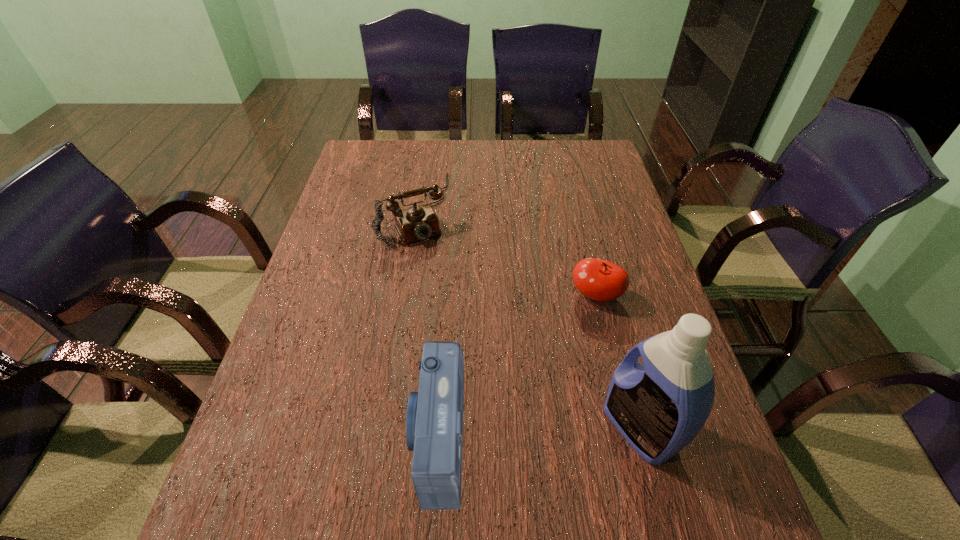
Find the location of a particular element. This screenshot has width=960, height=540. object at the far left corner is located at coordinates (416, 223).

Locate an element on the screen. Image resolution: width=960 pixels, height=540 pixels. object that is at the near right corner is located at coordinates (659, 407).

In order to click on free point at the far edge in this screenshot , I will do (534, 141).

In the image, there is a desktop. What are the coordinates of `vacant space at the near edge` in the screenshot? It's located at (487, 444).

In order to click on vacant region at the left edge of the desktop in this screenshot , I will do pyautogui.click(x=390, y=185).

The width and height of the screenshot is (960, 540). In the image, there is a desktop. Identify the location of free space at the right edge. (651, 279).

Locate an element on the screen. blank space at the far left corner of the desktop is located at coordinates (394, 160).

Identify the location of vacant space at the far right corner of the desktop. Image resolution: width=960 pixels, height=540 pixels. (601, 172).

Locate an element on the screen. This screenshot has height=540, width=960. free area in between the camera and the tallest object is located at coordinates (539, 433).

The width and height of the screenshot is (960, 540). I want to click on vacant area that lies between the detergent and the farthest object, so click(526, 319).